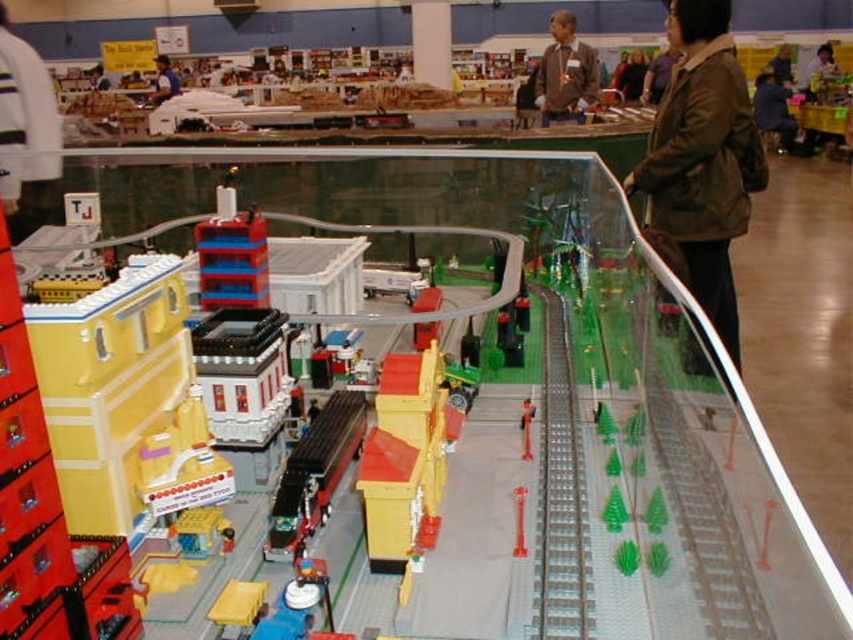
Consider the image. You are standing in front of the model train display and want to place a new decorative item between the silver metallic train track at center and the blue shirt at upper left. The decorative item is 3 feet long. Is there enough space between them to place it without overlapping?

The silver metallic train track at center is 27.96 feet away from the blue shirt at upper left. Since the decorative item is only 3 feet long, there is sufficient space between them to place it without overlapping.

You are a visitor at the train exhibition and notice the metallic red train at center and the matte gray sweater at upper center. Which object is positioned higher in the display?

The matte gray sweater at upper center is positioned higher than the metallic red train at center.

You are a model train enthusiast examining the display. You notice the silver metallic train track at center. Can you determine its position relative to the train station on the left side of the display?

The silver metallic train track at center is located at point coordinates approximately 0.767 on the x axis and 0.658 on the y axis, which places it towards the lower right section of the display relative to the train station on the left side.